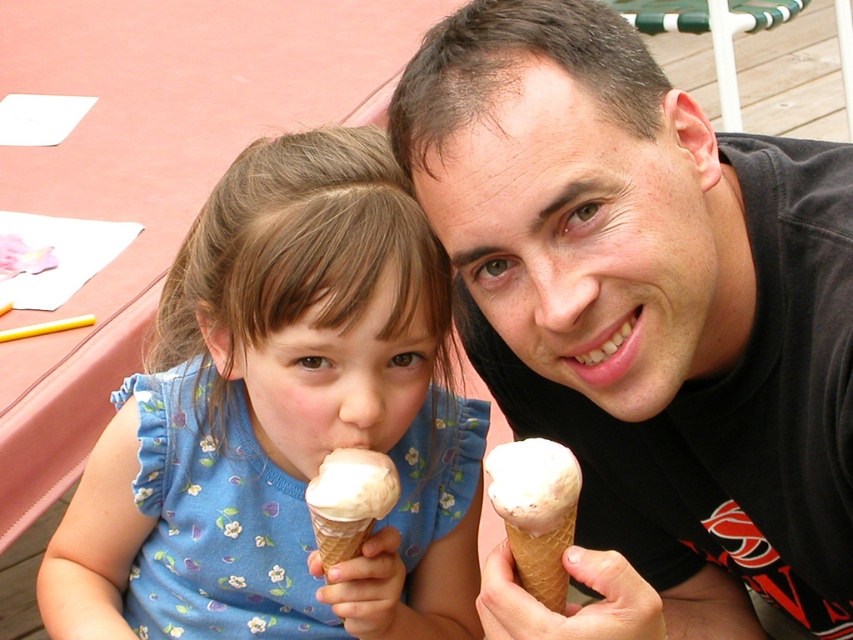
You are a photographer standing at a distance of 30 inches from the blue floral dress at center. Can you reach out and touch it without moving?

The blue floral dress at center is 33.60 inches from viewer, which is farther than your current distance of 30 inches, so you cannot reach it without moving closer.

Based on the photo, you are a photographer trying to capture a candid shot of the blue floral dress at center and the vanilla ice cream in waffle cone at right. If your camera has a maximum focus range of 12 inches, will both subjects be in focus?

The distance between the blue floral dress at center and the vanilla ice cream in waffle cone at right is 12.98 inches, which exceeds the camera maximum focus range of 12 inches. Therefore, both subjects cannot be in focus simultaneously.